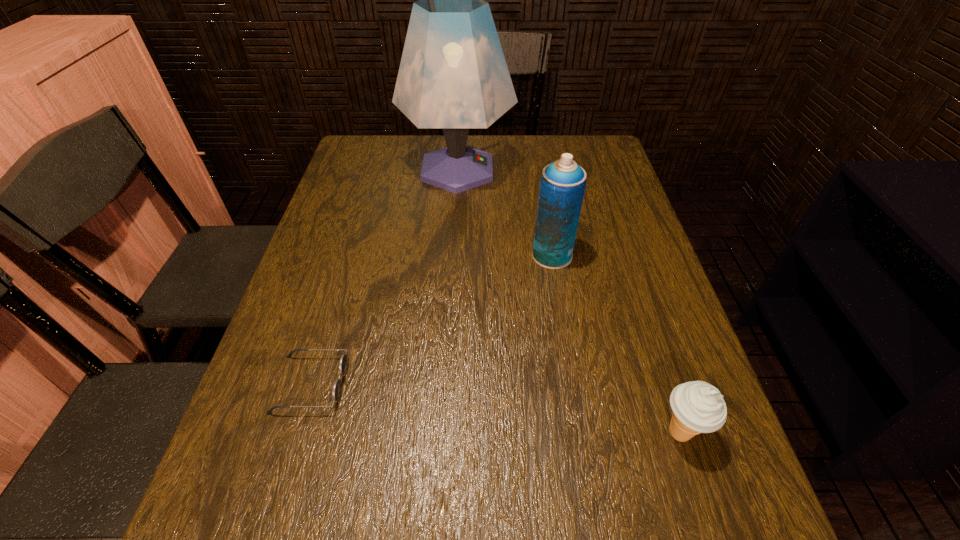
This screenshot has width=960, height=540. In order to click on vacant space located on the left of the rightmost object in this screenshot , I will do `click(474, 433)`.

I want to click on free space located 0.120m on the front-facing side of the shortest object, so click(x=407, y=384).

Locate an element on the screen. object located at the far edge is located at coordinates (453, 75).

Where is `object that is positioned at the left edge`? object that is positioned at the left edge is located at coordinates (343, 363).

Where is `object present at the right edge`? The height and width of the screenshot is (540, 960). object present at the right edge is located at coordinates (698, 407).

What are the coordinates of `vacant space at the far edge` in the screenshot? It's located at (410, 161).

Where is `vacant space at the left edge of the desktop`? Image resolution: width=960 pixels, height=540 pixels. vacant space at the left edge of the desktop is located at coordinates (271, 346).

This screenshot has width=960, height=540. What are the coordinates of `free location at the right edge of the desktop` in the screenshot? It's located at 701,369.

Locate an element on the screen. The width and height of the screenshot is (960, 540). vacant area at the far left corner is located at coordinates (353, 163).

In the image, there is a desktop. Where is `free space at the far right corner`? free space at the far right corner is located at coordinates (598, 145).